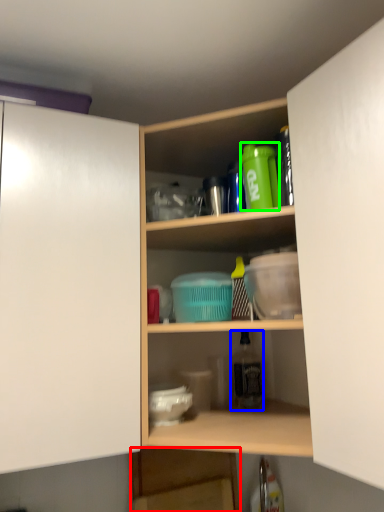
Question: Which is farther away from shelf (highlighted by a red box)? bottle (highlighted by a blue box) or bottle (highlighted by a green box)?

Choices:
 (A) bottle
 (B) bottle

Answer: (B)